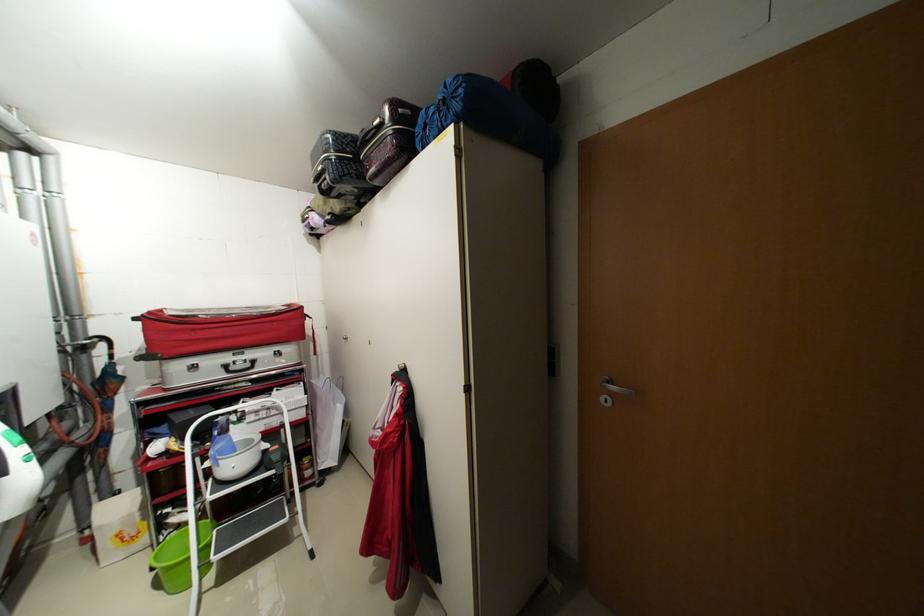
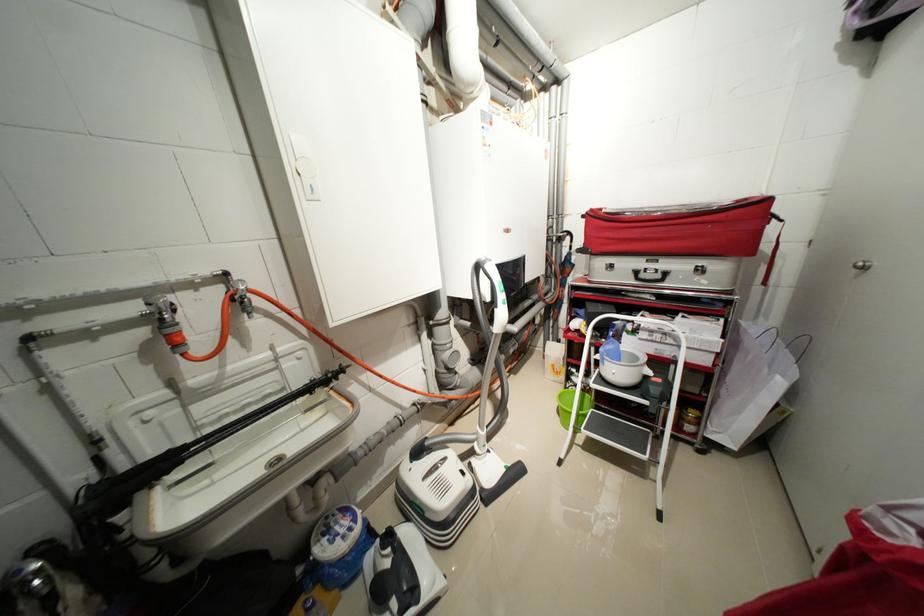
Where in the second image is the point corresponding to pixel 258 442 from the first image?

(642, 359)